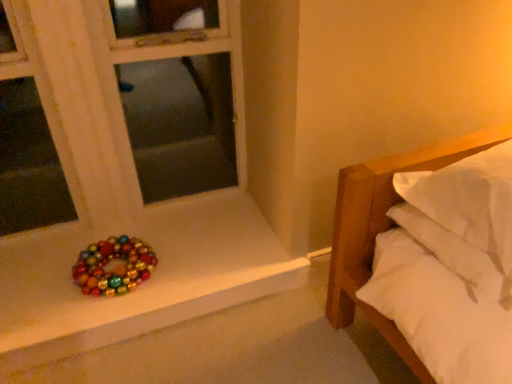
At what (x,y) coordinates should I click in order to perform the action: click on vacant area on the back side of glossy multicolored beads at lower left. Please return your answer as a coordinate pair (x, y). Looking at the image, I should click on (146, 231).